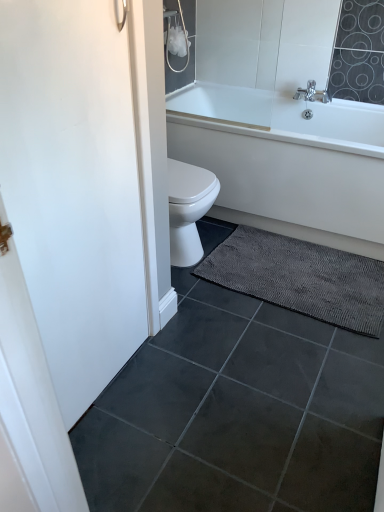
Question: Should I look upward or downward to see white glossy bathtub at upper right?

Choices:
 (A) down
 (B) up

Answer: (B)